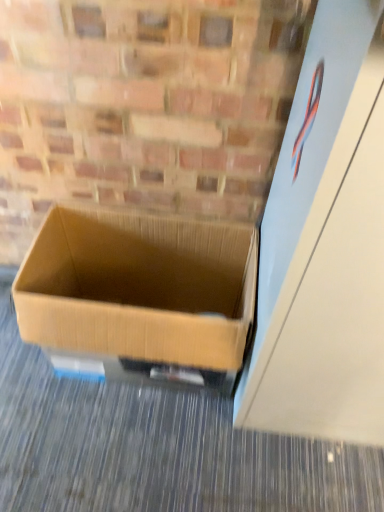
The width and height of the screenshot is (384, 512). Find the location of `brown cardboard box at lower left`. brown cardboard box at lower left is located at coordinates (139, 288).

Describe the element at coordinates (139, 288) in the screenshot. I see `brown cardboard box at lower left` at that location.

At what (x,y) coordinates should I click in order to perform the action: click on brown cardboard box at lower left. Please return your answer as a coordinate pair (x, y). The image size is (384, 512). Looking at the image, I should click on point(139,288).